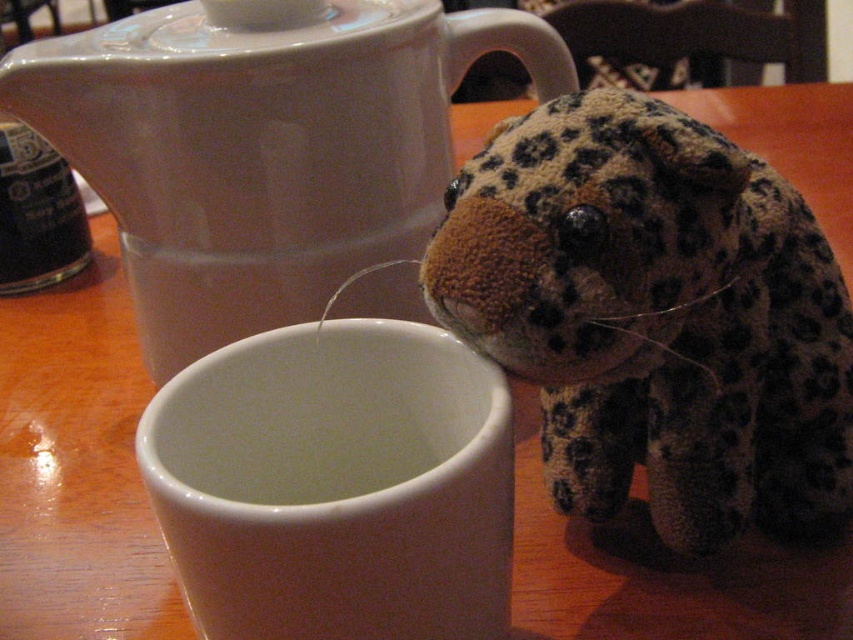
Between point (175, 236) and point (289, 477), which one is positioned in front?

Point (289, 477) is more forward.

At what (x,y) coordinates should I click in order to perform the action: click on white glossy teapot at upper center. Please return your answer as a coordinate pair (x, y). Looking at the image, I should click on (262, 148).

This screenshot has width=853, height=640. What do you see at coordinates (262, 148) in the screenshot? I see `white glossy teapot at upper center` at bounding box center [262, 148].

This screenshot has width=853, height=640. I want to click on white glossy teapot at upper center, so click(262, 148).

Does white matte cup at center have a lesser height compared to black matte bottle at left?

Yes, white matte cup at center is shorter than black matte bottle at left.

Who is positioned more to the right, white matte cup at center or black matte bottle at left?

white matte cup at center

Based on the photo, measure the distance between white matte cup at center and camera.

white matte cup at center is 20.62 inches away from camera.

The width and height of the screenshot is (853, 640). Identify the location of white matte cup at center. (318, 412).

Can you confirm if fuzzy leopard plush at right is positioned to the right of white matte cup at center?

Indeed, fuzzy leopard plush at right is positioned on the right side of white matte cup at center.

Is fuzzy leopard plush at right below white matte cup at center?

No, fuzzy leopard plush at right is not below white matte cup at center.

Describe the element at coordinates (654, 314) in the screenshot. I see `fuzzy leopard plush at right` at that location.

Image resolution: width=853 pixels, height=640 pixels. Find the location of `fuzzy leopard plush at right`. fuzzy leopard plush at right is located at coordinates (654, 314).